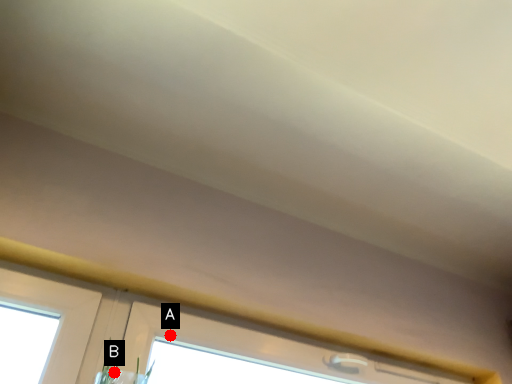
Question: Two points are circled on the image, labeled by A and B beside each circle. Which point is farther from the camera taking this photo?

Choices:
 (A) A is further
 (B) B is further

Answer: (A)